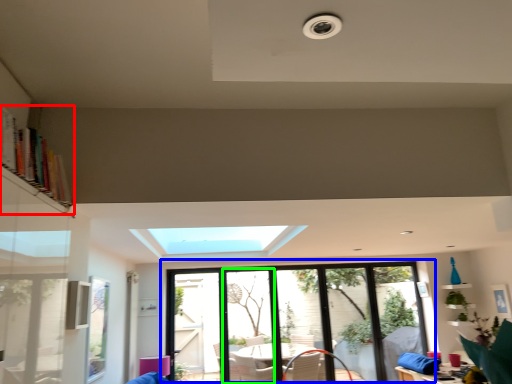
Question: Which object is the farthest from bookshelf (highlighted by a red box)? Choose among these: window (highlighted by a blue box) or screen door (highlighted by a green box).

Choices:
 (A) window
 (B) screen door

Answer: (B)